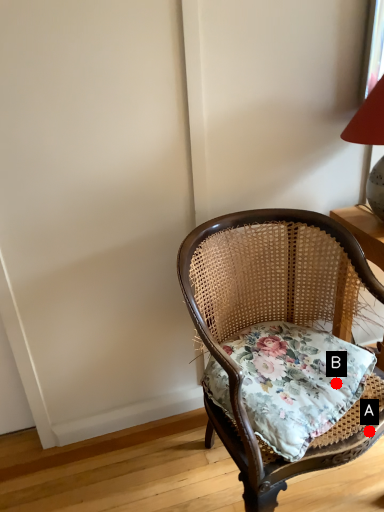
Question: Two points are circled on the image, labeled by A and B beside each circle. Which of the following is the farthest from the observer?

Choices:
 (A) A is further
 (B) B is further

Answer: (B)